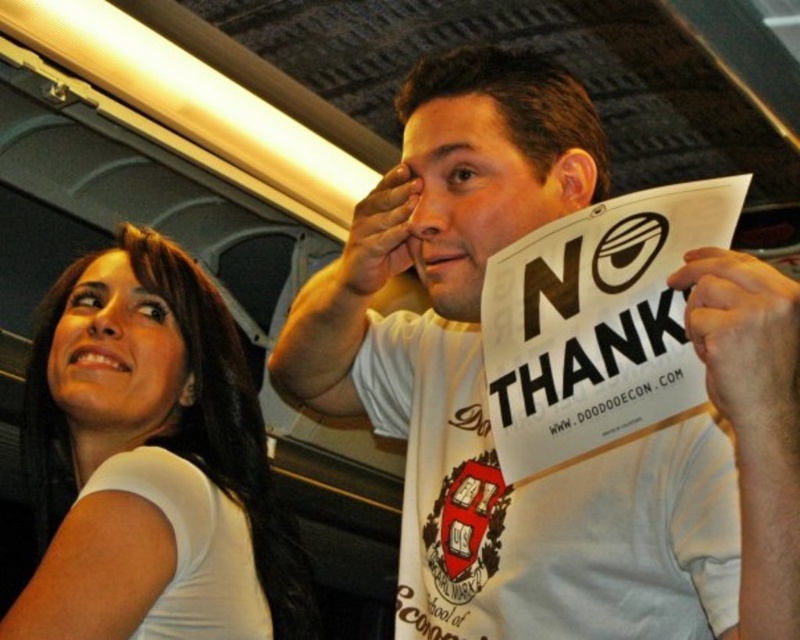
Is point (401, 392) positioned behind point (70, 428)?

Yes, point (401, 392) is behind point (70, 428).

Which is more to the right, white cotton t-shirt at center or white matte shirt at upper left?

white cotton t-shirt at center

Which is in front, point (762, 304) or point (240, 449)?

Positioned in front is point (762, 304).

Find the location of a particular element. The image size is (800, 640). white cotton t-shirt at center is located at coordinates (484, 392).